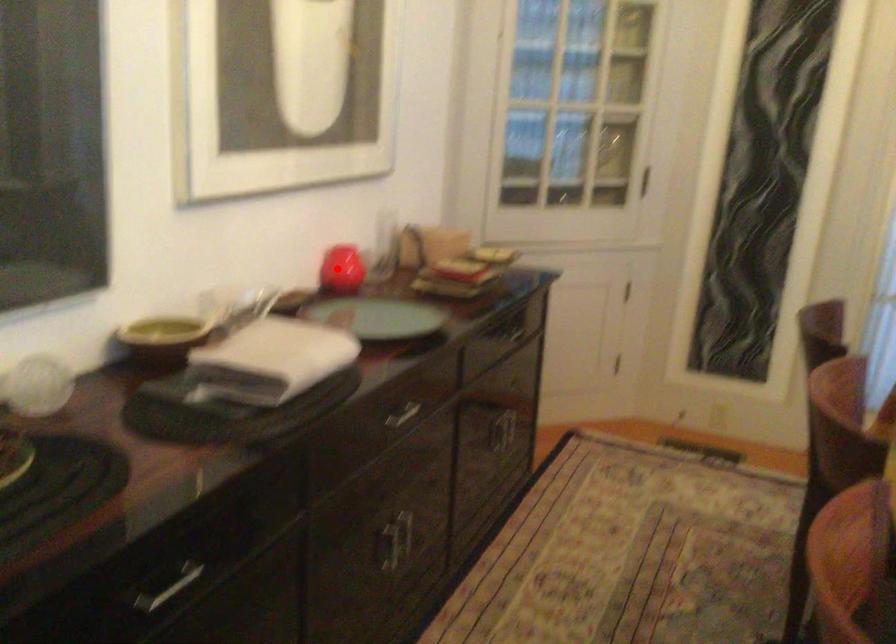
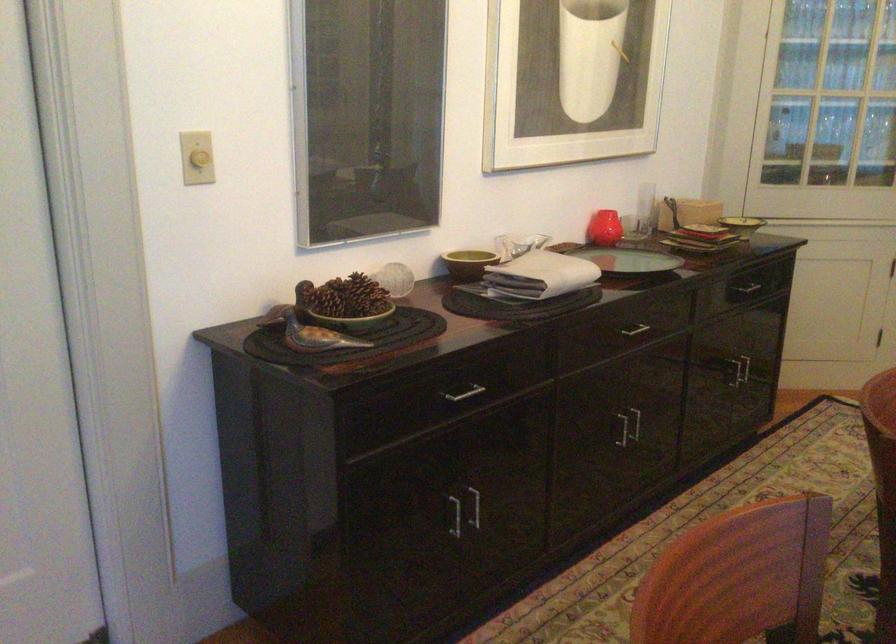
In the second image, find the point that corresponds to the highlighted location in the first image.

(604, 228)